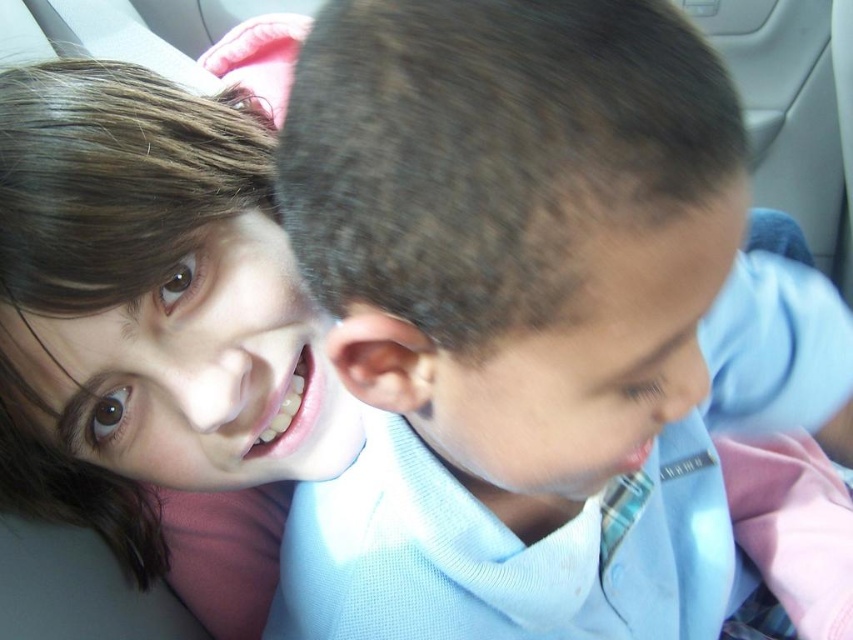
You are a photographer trying to adjust the focus of your camera. You notice two elements in the frame that need attention. Which of the two objects, the light blue shirt at center or the smooth skin face at upper left, requires a larger aperture setting to ensure proper focus?

The light blue shirt at center is bigger than the smooth skin face at upper left, so it requires a larger aperture setting to ensure proper focus.

You are a photographer standing 12 inches away from the car. You want to take a photo of the point at coordinates point (360,196). Will you be able to focus on that point without moving closer?

The distance of point (360,196) from viewer is 11.16 inches, so yes, you can focus on that point without moving closer since you are only 12 inches away, which is slightly farther than the point.

Based on the scene described, where is the light blue shirt at center located in the image?

The light blue shirt at center is located at point (535, 321).